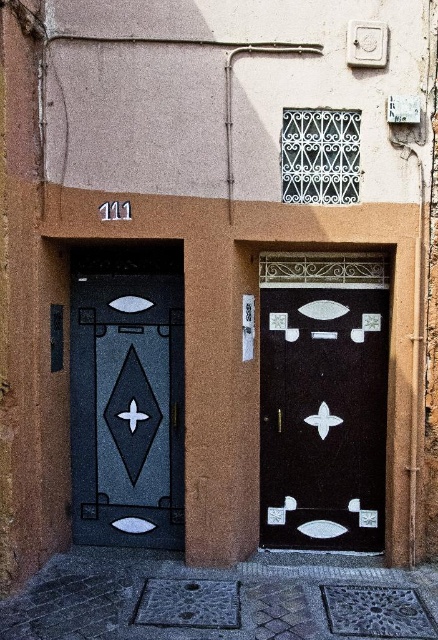
Who is more distant from viewer, (246,621) or (353,352)?

Point (353,352)

Which is in front, point (142, 586) or point (260, 522)?

Point (142, 586) is more forward.

Identify the location of smooth stone pavement at lower center. This screenshot has height=640, width=438. (219, 598).

Is point (272, 404) more distant than point (98, 404)?

No.

Can you confirm if black glossy door at center is positioned to the right of matte black door at center?

Yes, black glossy door at center is to the right of matte black door at center.

In order to click on black glossy door at center in this screenshot , I will do `click(322, 417)`.

Is smooth stone pavement at lower center positioned at the back of matte black door at center?

That is False.

Which is more to the right, smooth stone pavement at lower center or matte black door at center?

smooth stone pavement at lower center is more to the right.

Which is in front, point (108, 550) or point (112, 390)?

Positioned in front is point (112, 390).

At what (x,y) coordinates should I click in order to perform the action: click on smooth stone pavement at lower center. Please return your answer as a coordinate pair (x, y). Image resolution: width=438 pixels, height=640 pixels. Looking at the image, I should click on (219, 598).